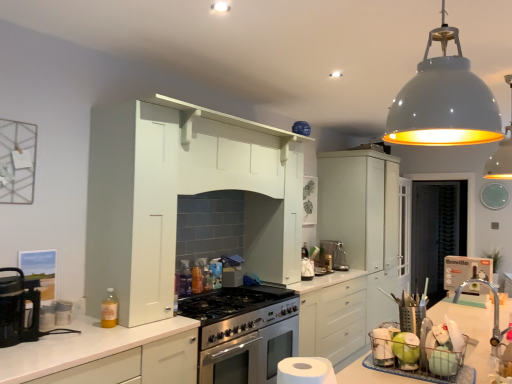
You are a GUI agent. You are given a task and a screenshot of the screen. Output one action in this format:
    pyautogui.click(x=<x>, y=<y>)
    Task: Click on the free region on the left part of translucent yellow bottle at lower left
    This screenshot has height=384, width=512.
    Given the screenshot: What is the action you would take?
    pyautogui.click(x=83, y=315)